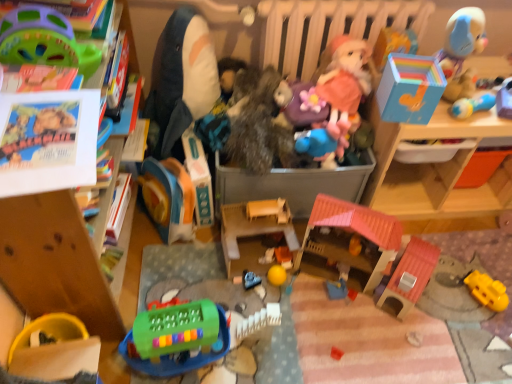
Where is `matte orange plush at center, the 13th toy when ordered from right to left`? matte orange plush at center, the 13th toy when ordered from right to left is located at coordinates (168, 198).

Describe the element at coordinates (472, 105) in the screenshot. I see `blue rubber ball at upper right, positioned as the third toy in right-to-left order` at that location.

You are a GUI agent. You are given a task and a screenshot of the screen. Output one action in this format:
    pyautogui.click(x=<x>, y=<y>)
    Task: Click on the yellow rubber ball at center, the ninth toy when ordered from left to right
    
    Given the screenshot: What is the action you would take?
    pyautogui.click(x=277, y=275)

This screenshot has width=512, height=384. What do you see at coordinates (176, 338) in the screenshot?
I see `green plastic keyboard at lower left, the twelfth toy viewed from the right` at bounding box center [176, 338].

At what (x,y) coordinates should I click in order to perform the action: click on wooden toy storage at upper right. Please return your answer as a coordinate pair (x, y). The image size is (512, 384). Looking at the image, I should click on (432, 169).

Where is `matte orange plush at center, placed as the 4th toy when sorted from left to right`? The height and width of the screenshot is (384, 512). matte orange plush at center, placed as the 4th toy when sorted from left to right is located at coordinates (168, 198).

From a real-world perspective, is yellow plastic blocks at lower right, the 2th toy from the right, over green plastic steering wheel at upper left, positioned as the 3th toy in left-to-right order?

No.

Which object is wider, yellow plastic blocks at lower right, acting as the fifteenth toy starting from the left, or green plastic steering wheel at upper left, positioned as the 3th toy in left-to-right order?

With larger width is green plastic steering wheel at upper left, positioned as the 3th toy in left-to-right order.

From the image's perspective, is yellow plastic blocks at lower right, acting as the fifteenth toy starting from the left, above green plastic steering wheel at upper left, marked as the 14th toy in a right-to-left arrangement?

No.

How much distance is there between yellow plastic blocks at lower right, the 2th toy from the right, and green plastic steering wheel at upper left, marked as the 14th toy in a right-to-left arrangement?

They are 5.08 feet apart.

Does rainbow plastic box at upper right, which is the 13th toy in left-to-right order, appear on the left side of blue rubber ball at upper right, positioned as the third toy in right-to-left order?

Indeed, rainbow plastic box at upper right, which is the 13th toy in left-to-right order, is positioned on the left side of blue rubber ball at upper right, positioned as the third toy in right-to-left order.

From the image's perspective, between rainbow plastic box at upper right, which ranks as the 4th toy in right-to-left order, and blue rubber ball at upper right, positioned as the third toy in right-to-left order, who is located below?

blue rubber ball at upper right, positioned as the third toy in right-to-left order, from the image's perspective.

Is rainbow plastic box at upper right, which ranks as the 4th toy in right-to-left order, oriented away from blue rubber ball at upper right, positioned as the third toy in right-to-left order?

No, rainbow plastic box at upper right, which ranks as the 4th toy in right-to-left order,'s orientation is not away from blue rubber ball at upper right, positioned as the third toy in right-to-left order.

Considering the positions of point (397, 32) and point (486, 94), is point (397, 32) closer or farther from the camera than point (486, 94)?

Point (397, 32) appears to be farther away from the viewer than point (486, 94).

Can you confirm if wooden radiator at upper center is bigger than green plastic steering wheel at upper left, marked as the 14th toy in a right-to-left arrangement?

Correct, wooden radiator at upper center is larger in size than green plastic steering wheel at upper left, marked as the 14th toy in a right-to-left arrangement.

Are wooden radiator at upper center and green plastic steering wheel at upper left, marked as the 14th toy in a right-to-left arrangement, making contact?

No, wooden radiator at upper center is not next to green plastic steering wheel at upper left, marked as the 14th toy in a right-to-left arrangement.

Considering the positions of objects wooden radiator at upper center and green plastic steering wheel at upper left, marked as the 14th toy in a right-to-left arrangement, in the image provided, who is more to the left, wooden radiator at upper center or green plastic steering wheel at upper left, marked as the 14th toy in a right-to-left arrangement,?

From the viewer's perspective, green plastic steering wheel at upper left, marked as the 14th toy in a right-to-left arrangement, appears more on the left side.

Which point is more forward, (315, 36) or (11, 48)?

The point (11, 48) is in front.

Is green plastic steering wheel at upper left, positioned as the 3th toy in left-to-right order, turned away from wooden radiator at upper center?

green plastic steering wheel at upper left, positioned as the 3th toy in left-to-right order, does not have its back to wooden radiator at upper center.

Is green plastic steering wheel at upper left, positioned as the 3th toy in left-to-right order, to the left or to the right of wooden radiator at upper center in the image?

green plastic steering wheel at upper left, positioned as the 3th toy in left-to-right order, is to the left of wooden radiator at upper center.

How far apart are green plastic steering wheel at upper left, marked as the 14th toy in a right-to-left arrangement, and wooden radiator at upper center?

green plastic steering wheel at upper left, marked as the 14th toy in a right-to-left arrangement, and wooden radiator at upper center are 36.80 inches apart from each other.

Is green plastic steering wheel at upper left, marked as the 14th toy in a right-to-left arrangement, wider or thinner than wooden radiator at upper center?

In the image, green plastic steering wheel at upper left, marked as the 14th toy in a right-to-left arrangement, appears to be wider than wooden radiator at upper center.

From a real-world perspective, who is located higher, metallic gray storage box at center, the 2th storage box viewed from the front, or fuzzy fabric stuffed animal at center, placed as the seventh toy when sorted from left to right?

fuzzy fabric stuffed animal at center, placed as the seventh toy when sorted from left to right, is physically above.

Would you say metallic gray storage box at center, which is the second storage box in right-to-left order, is to the left or to the right of fuzzy fabric stuffed animal at center, placed as the seventh toy when sorted from left to right, in the picture?

From the image, it's evident that metallic gray storage box at center, which is the second storage box in right-to-left order, is to the right of fuzzy fabric stuffed animal at center, placed as the seventh toy when sorted from left to right.

Is metallic gray storage box at center, the 1th storage box from the back, next to fuzzy fabric stuffed animal at center, which is the tenth toy in right-to-left order, and touching it?

metallic gray storage box at center, the 1th storage box from the back, and fuzzy fabric stuffed animal at center, which is the tenth toy in right-to-left order, are not in contact.

Choose the correct answer: Is metallic gray storage box at center, which is the second storage box in right-to-left order, inside fuzzy fabric stuffed animal at center, placed as the seventh toy when sorted from left to right, or outside it?

metallic gray storage box at center, which is the second storage box in right-to-left order, is not enclosed by fuzzy fabric stuffed animal at center, placed as the seventh toy when sorted from left to right.

From the image's perspective, relative to wooden farm at center, the eighth toy viewed from the left, is green plastic toy at left, placed as the second toy when sorted from left to right, above or below?

Based on their image positions, green plastic toy at left, placed as the second toy when sorted from left to right, is located above wooden farm at center, the eighth toy viewed from the left.

Between green plastic toy at left, placed as the second toy when sorted from left to right, and wooden farm at center, which is counted as the 9th toy, starting from the right, which one is positioned in front?

green plastic toy at left, placed as the second toy when sorted from left to right, is more forward.

Is green plastic toy at left, which ranks as the fifteenth toy in right-to-left order, far from wooden farm at center, which is counted as the 9th toy, starting from the right?

No, there isn't a large distance between green plastic toy at left, which ranks as the fifteenth toy in right-to-left order, and wooden farm at center, which is counted as the 9th toy, starting from the right.

Which of these two, green plastic toy at left, placed as the second toy when sorted from left to right, or wooden farm at center, which is counted as the 9th toy, starting from the right, is bigger?

With larger size is green plastic toy at left, placed as the second toy when sorted from left to right.

Does green plastic steering wheel at upper left, marked as the 14th toy in a right-to-left arrangement, come in front of rubber yellow bowl at lower left, acting as the sixteenth toy starting from the right?

Yes, it is.

Is rubber yellow bowl at lower left, acting as the sixteenth toy starting from the right, located within green plastic steering wheel at upper left, marked as the 14th toy in a right-to-left arrangement?

No, rubber yellow bowl at lower left, acting as the sixteenth toy starting from the right, is not inside green plastic steering wheel at upper left, marked as the 14th toy in a right-to-left arrangement.

From the image's perspective, which object appears higher, green plastic steering wheel at upper left, marked as the 14th toy in a right-to-left arrangement, or rubber yellow bowl at lower left, acting as the sixteenth toy starting from the right?

green plastic steering wheel at upper left, marked as the 14th toy in a right-to-left arrangement.

Does green plastic steering wheel at upper left, positioned as the 3th toy in left-to-right order, turn towards rubber yellow bowl at lower left, arranged as the first toy when viewed from the left?

No, green plastic steering wheel at upper left, positioned as the 3th toy in left-to-right order, is not aimed at rubber yellow bowl at lower left, arranged as the first toy when viewed from the left.

You are a GUI agent. You are given a task and a screenshot of the screen. Output one action in this format:
    pyautogui.click(x=<x>, y=<y>)
    Task: Click on the 9th toy in front of the yellow plastic blocks at lower right, acting as the fifteenth toy starting from the left, counting from the anchor's position
    The height and width of the screenshot is (384, 512).
    Given the screenshot: What is the action you would take?
    pyautogui.click(x=44, y=40)

From a real-world perspective, starting from the blue rubber ball at upper right, positioned as the third toy in right-to-left order, which toy is the 1st one vertically above it? Please provide its 2D coordinates.

[(393, 44)]

Considering their positions, is blue rubber duck at center, placed as the 5th toy when sorted from right to left, positioned further to smooth blue car at center, arranged as the sixth toy when viewed from the left, than green plastic keyboard at lower left, the twelfth toy viewed from the right?

The object further to smooth blue car at center, arranged as the sixth toy when viewed from the left, is blue rubber duck at center, placed as the 5th toy when sorted from right to left.

Which object lies further to the anchor point fuzzy fabric stuffed animal at center, placed as the seventh toy when sorted from left to right, rainbow plastic box at upper right, which is the 13th toy in left-to-right order, or wooden radiator at upper center?

rainbow plastic box at upper right, which is the 13th toy in left-to-right order, is positioned further to the anchor fuzzy fabric stuffed animal at center, placed as the seventh toy when sorted from left to right.

Which object lies further to the anchor point blue rubber duck at center, placed as the 12th toy when sorted from left to right, fuzzy fabric stuffed animal at center, which is the tenth toy in right-to-left order, or rainbow plastic box at upper right, which is the 13th toy in left-to-right order?

rainbow plastic box at upper right, which is the 13th toy in left-to-right order.

Consider the image. Estimate the real-world distances between objects in this image. Which object is closer to fuzzy fabric stuffed animal at center, which is the tenth toy in right-to-left order, yellow plastic blocks at lower right, acting as the fifteenth toy starting from the left, or rainbow plastic box at upper right, which is the 13th toy in left-to-right order?

rainbow plastic box at upper right, which is the 13th toy in left-to-right order.

Which object lies nearer to the anchor point green plastic keyboard at lower left, the twelfth toy viewed from the right, rainbow plastic box at upper right, which is the 13th toy in left-to-right order, or matte orange plush at center, placed as the 4th toy when sorted from left to right?

The object closer to green plastic keyboard at lower left, the twelfth toy viewed from the right, is matte orange plush at center, placed as the 4th toy when sorted from left to right.

Estimate the real-world distances between objects in this image. Which object is closer to blue rubber ball at upper right, positioned as the third toy in right-to-left order, rubber yellow bowl at lower left, arranged as the first toy when viewed from the left, or green plastic keyboard at lower left, the 5th toy viewed from the left?

green plastic keyboard at lower left, the 5th toy viewed from the left, is closer to blue rubber ball at upper right, positioned as the third toy in right-to-left order.

Estimate the real-world distances between objects in this image. Which object is further from green plastic toy at left, which ranks as the fifteenth toy in right-to-left order, blue rubber duck at center, placed as the 12th toy when sorted from left to right, or green plastic keyboard at lower left, the twelfth toy viewed from the right?

blue rubber duck at center, placed as the 12th toy when sorted from left to right, lies further to green plastic toy at left, which ranks as the fifteenth toy in right-to-left order, than the other object.

From the image, which object appears to be farther from rubber yellow bowl at lower left, acting as the sixteenth toy starting from the right, yellow rubber ball at center, acting as the eighth toy starting from the right, or green plastic keyboard at lower left, the twelfth toy viewed from the right?

yellow rubber ball at center, acting as the eighth toy starting from the right.

Find the location of a particular element. The width and height of the screenshot is (512, 384). changing table between blue cardboard storage box at upper right, positioned as the first storage box in right-to-left order, and smooth plastic ball at upper right, marked as the 16th toy in a left-to-right arrangement is located at coordinates (432, 169).

Identify the location of changing table between wooden radiator at upper center and yellow plastic blocks at lower right, acting as the fifteenth toy starting from the left, in the vertical direction. The width and height of the screenshot is (512, 384). (432, 169).

The image size is (512, 384). Identify the location of storage box located between fuzzy fabric stuffed animal at center, which is the tenth toy in right-to-left order, and blue cardboard storage box at upper right, positioned as the first storage box in right-to-left order, in the left-right direction. (292, 184).

Where is `radiator between metallic gray storage box at center, the 2th storage box viewed from the front, and wooden toy storage at upper right from left to right`? The height and width of the screenshot is (384, 512). radiator between metallic gray storage box at center, the 2th storage box viewed from the front, and wooden toy storage at upper right from left to right is located at coordinates (328, 27).